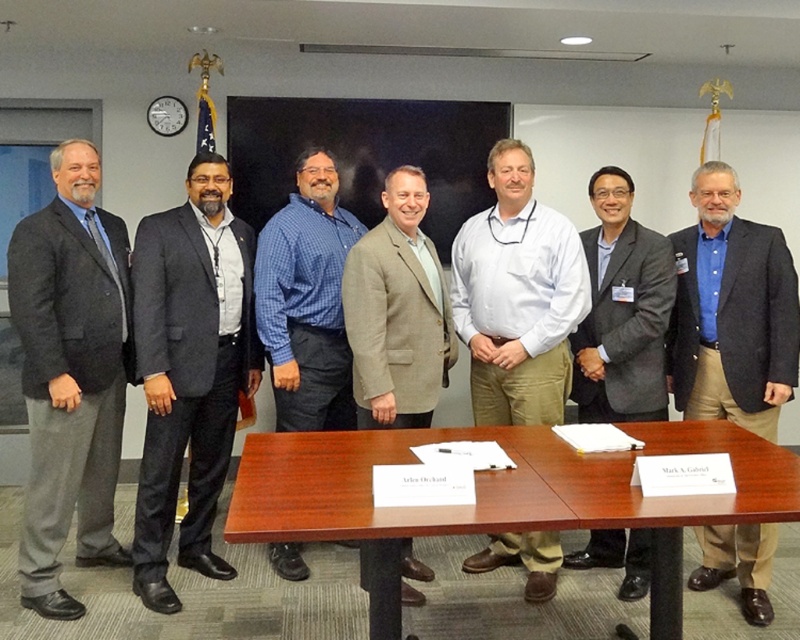
Is white cotton shirt at center wider than tan textured blazer at center?

Correct, the width of white cotton shirt at center exceeds that of tan textured blazer at center.

In the scene shown: Does white cotton shirt at center have a lesser width compared to tan textured blazer at center?

No.

Does point (478, 420) come farther from viewer compared to point (400, 548)?

That is True.

In order to click on white cotton shirt at center in this screenshot , I will do `click(517, 296)`.

How much distance is there between brown wood table at center and gray suit at center?

A distance of 34.60 inches exists between brown wood table at center and gray suit at center.

Does brown wood table at center have a greater width compared to gray suit at center?

Correct, the width of brown wood table at center exceeds that of gray suit at center.

Between point (320, 483) and point (621, 285), which one is positioned in front?

Point (320, 483) is more forward.

Find the location of a particular element. brown wood table at center is located at coordinates (508, 490).

Can you confirm if dark gray suit at left is wider than dark gray suit at center?

Incorrect, dark gray suit at left's width does not surpass dark gray suit at center's.

Who is positioned more to the left, dark gray suit at left or dark gray suit at center?

From the viewer's perspective, dark gray suit at left appears more on the left side.

The width and height of the screenshot is (800, 640). In order to click on dark gray suit at left in this screenshot , I will do `click(70, 374)`.

You are a GUI agent. You are given a task and a screenshot of the screen. Output one action in this format:
    pyautogui.click(x=<x>, y=<y>)
    Task: Click on the dark gray suit at left
    Image resolution: width=800 pixels, height=640 pixels.
    Given the screenshot: What is the action you would take?
    pyautogui.click(x=70, y=374)